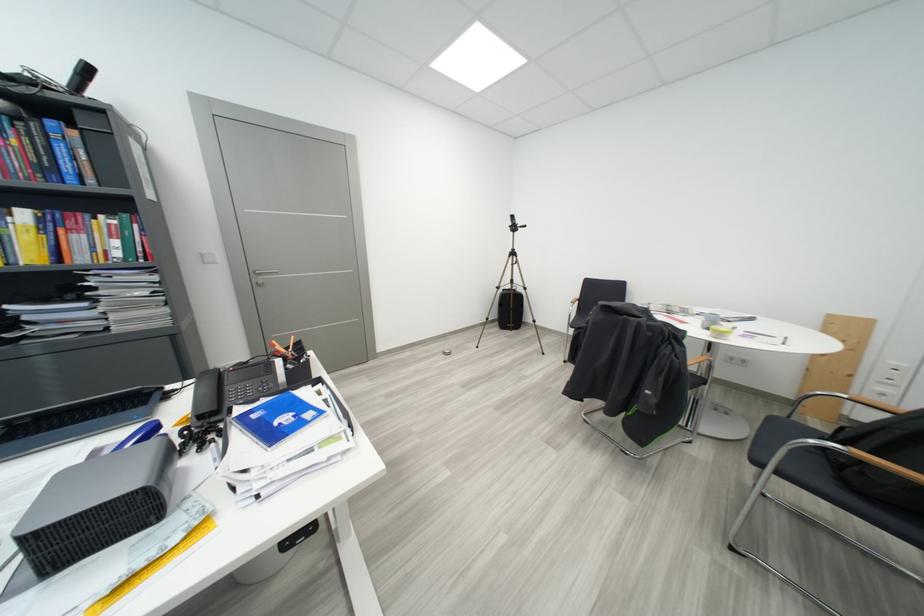
Find where to lift the blue hardcover book. Please return your answer as a coordinate pair (x, y).

(276, 419)